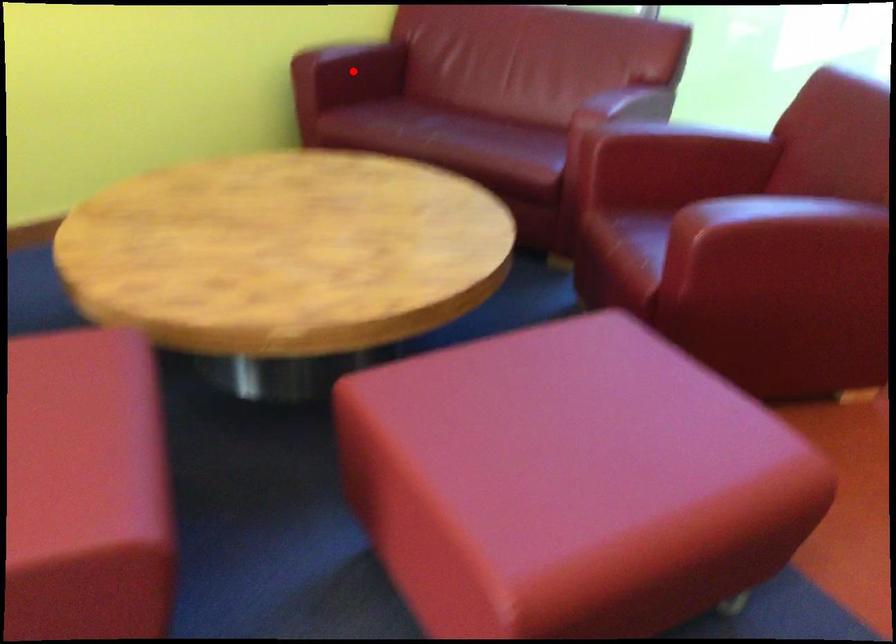
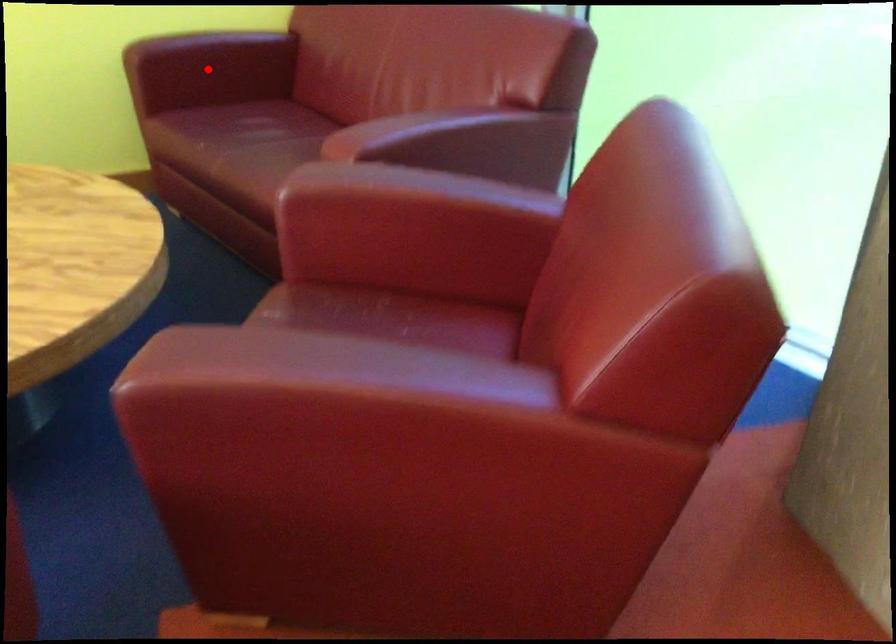
I am providing you with two images of the same scene from different viewpoints. A red point is marked on the first image and another point is marked on the second image. Does the point marked in image1 correspond to the same location as the one in image2?

Yes